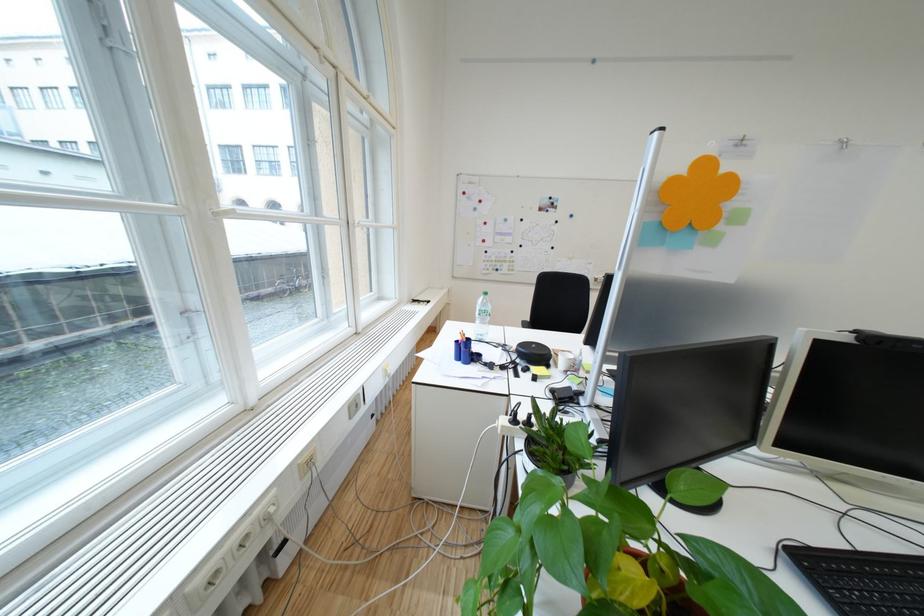
The location [463,349] corresponds to which object?

It corresponds to the blue pen holder in the image.